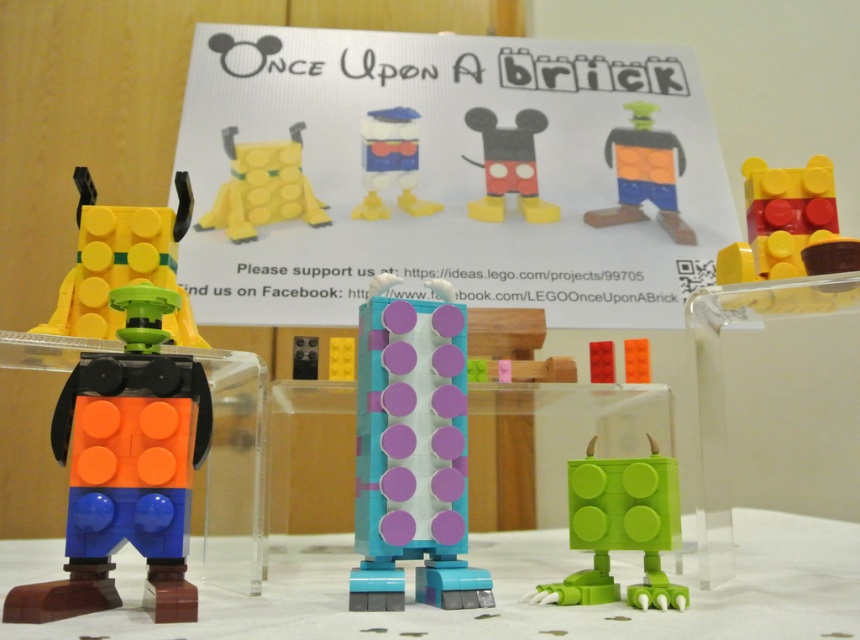
Question: Where is green matte toy at lower right located in relation to brick-like yellow bear at upper right in the image?

Choices:
 (A) above
 (B) below

Answer: (B)

Question: Which of the following is the closest to the observer?

Choices:
 (A) white paper sign at center
 (B) green matte toy at lower right
 (C) translucent blue plastic tower at center

Answer: (C)

Question: Does white glossy table at center have a greater width compared to green matte toy at lower right?

Choices:
 (A) no
 (B) yes

Answer: (B)

Question: Based on their relative distances, which object is nearer to the matte plastic mickey mouse head at center?

Choices:
 (A) matte plastic duck at center
 (B) orange matte/soft plastic toy at left
 (C) green matte toy at lower right
 (D) matte yellow plastic toy at left

Answer: (A)

Question: Among these points, which one is nearest to the camera?

Choices:
 (A) (103, 284)
 (B) (326, 560)

Answer: (A)

Question: Does white glossy table at center appear over brick-like yellow bear at upper right?

Choices:
 (A) no
 (B) yes

Answer: (A)